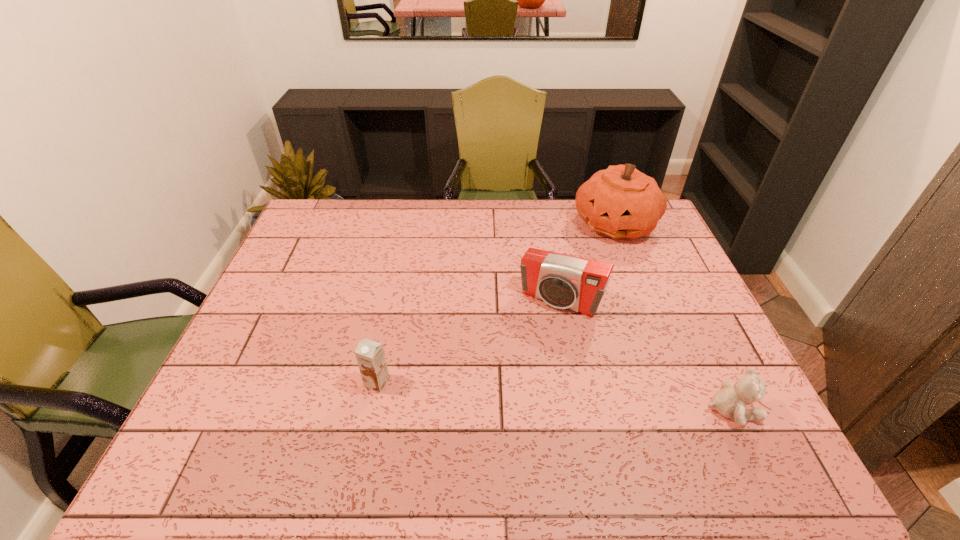
This screenshot has height=540, width=960. Find the location of `the leftmost object`. the leftmost object is located at coordinates (370, 356).

Locate an element on the screen. The image size is (960, 540). the shortest object is located at coordinates (730, 402).

Locate an element on the screen. This screenshot has height=540, width=960. pumpkin is located at coordinates (620, 202).

You are a GUI agent. You are given a task and a screenshot of the screen. Output one action in this format:
    pyautogui.click(x=<x>, y=<y>)
    Task: Click on the tallest object
    
    Given the screenshot: What is the action you would take?
    pyautogui.click(x=620, y=202)

Image resolution: width=960 pixels, height=540 pixels. I want to click on the second farthest object, so click(562, 281).

The image size is (960, 540). Identify the location of free space located on the front of the chocolate milk. (371, 416).

Where is `vacant space located 0.170m on the front-facing side of the tallest object`? The width and height of the screenshot is (960, 540). vacant space located 0.170m on the front-facing side of the tallest object is located at coordinates (606, 281).

At what (x,y) coordinates should I click in order to perform the action: click on vacant space situated on the front-facing side of the tallest object. Please return your answer as a coordinate pair (x, y). Looking at the image, I should click on (603, 294).

The width and height of the screenshot is (960, 540). In order to click on blank area located on the front-facing side of the tallest object in this screenshot , I will do point(600,318).

I want to click on free space located 0.340m on the front-facing side of the second farthest object, so 490,416.